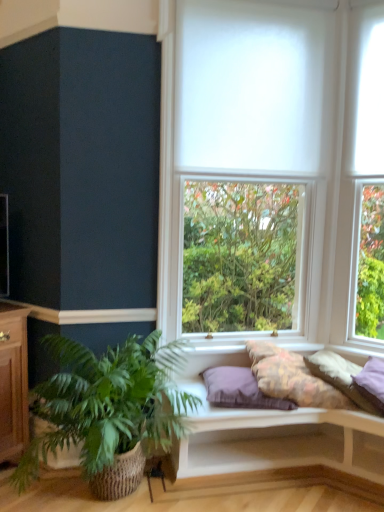
I want to click on vacant space situated above white matte blind at upper center (from a real-world perspective), so click(x=285, y=4).